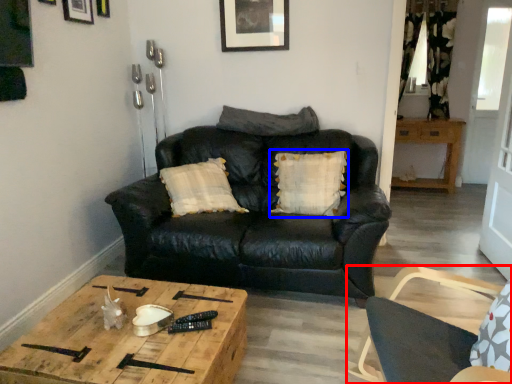
Question: Among these objects, which one is farthest to the camera, chair (highlighted by a red box) or pillow (highlighted by a blue box)?

Choices:
 (A) chair
 (B) pillow

Answer: (B)